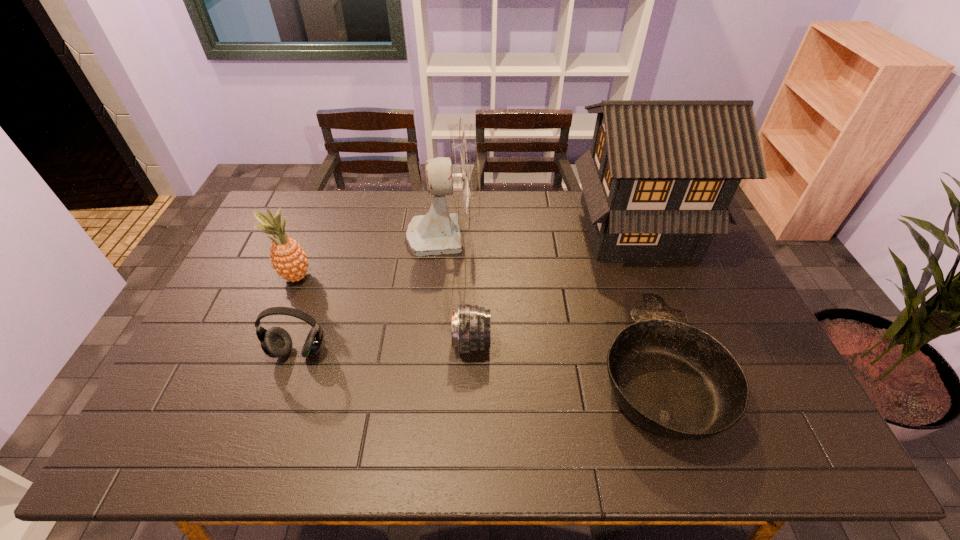
Where is `object that is at the far right corner`? The height and width of the screenshot is (540, 960). object that is at the far right corner is located at coordinates (657, 182).

The image size is (960, 540). I want to click on object that is positioned at the near right corner, so click(676, 381).

This screenshot has width=960, height=540. In order to click on vacant position at the left edge of the desktop in this screenshot , I will do `click(242, 345)`.

At what (x,y) coordinates should I click in order to perform the action: click on vacant space at the right edge of the desktop. Please return your answer as a coordinate pair (x, y). The height and width of the screenshot is (540, 960). Looking at the image, I should click on (722, 337).

Locate an element on the screen. The height and width of the screenshot is (540, 960). free space between the telephoto lens and the frying pan is located at coordinates (564, 358).

Identify the location of free space between the telephoto lens and the headset. The width and height of the screenshot is (960, 540). (385, 347).

Where is `empty space between the fan and the dollhouse`? empty space between the fan and the dollhouse is located at coordinates (540, 232).

This screenshot has height=540, width=960. In order to click on empty space that is in between the telephoto lens and the dollhouse in this screenshot , I will do `click(554, 286)`.

The image size is (960, 540). I want to click on free space between the headset and the dollhouse, so click(468, 290).

Locate an element on the screen. vacant space that's between the shortest object and the third shortest object is located at coordinates (478, 363).